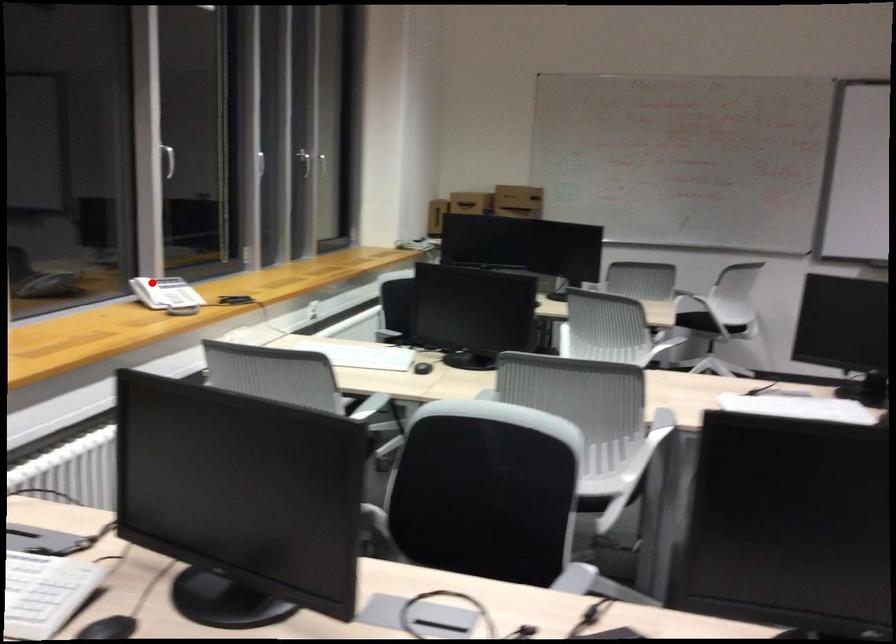
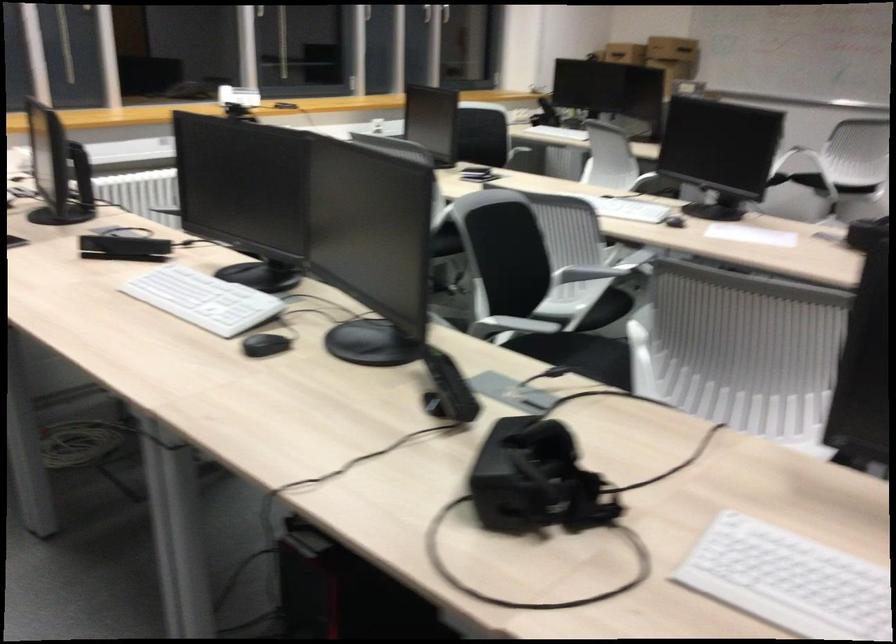
Question: A red point is marked in image1. In image2, is the corresponding 3D point closer to the camera or farther? Reply with the corresponding letter.

Choices:
 (A) The corresponding 3D point is closer.
 (B) The corresponding 3D point is farther.

Answer: (B)